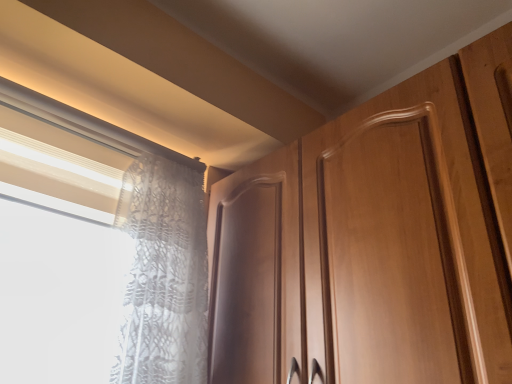
Question: Is white lace curtain at left wider or thinner than white lace curtain at upper left?

Choices:
 (A) wide
 (B) thin

Answer: (A)

Question: From a real-world perspective, is white lace curtain at left positioned above or below white lace curtain at upper left?

Choices:
 (A) below
 (B) above

Answer: (A)

Question: In terms of height, does white lace curtain at left look taller or shorter compared to white lace curtain at upper left?

Choices:
 (A) short
 (B) tall

Answer: (B)

Question: From a real-world perspective, is white lace curtain at upper left positioned above or below white lace curtain at left?

Choices:
 (A) above
 (B) below

Answer: (A)

Question: In the image, is white lace curtain at upper left positioned in front of or behind white lace curtain at left?

Choices:
 (A) front
 (B) behind

Answer: (A)

Question: Looking at the image, does white lace curtain at upper left seem bigger or smaller compared to white lace curtain at left?

Choices:
 (A) big
 (B) small

Answer: (B)

Question: From the image's perspective, is white lace curtain at upper left located above or below white lace curtain at left?

Choices:
 (A) below
 (B) above

Answer: (B)